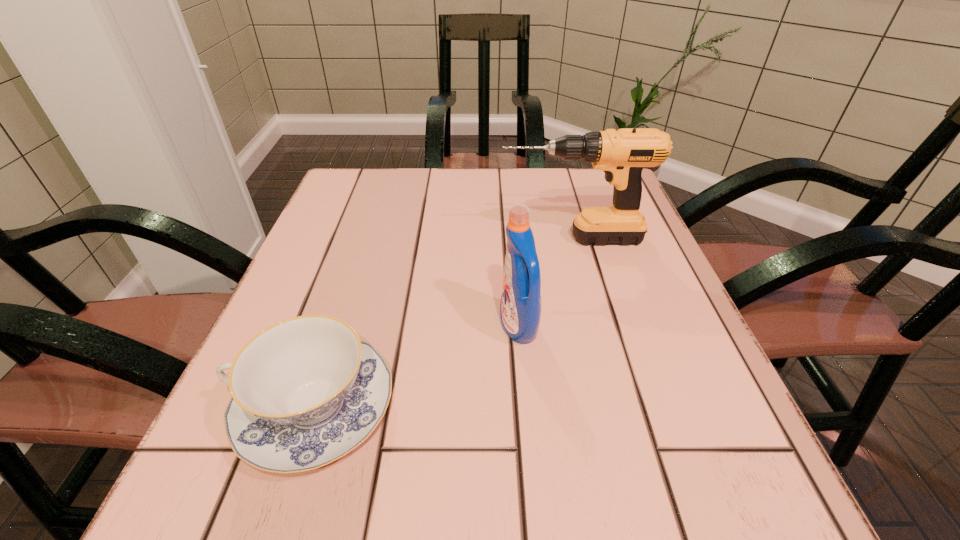
I want to click on empty location between the leftmost object and the farthest object, so click(x=444, y=323).

At what (x,y) coordinates should I click in order to perform the action: click on free spot between the detergent and the leftmost object. Please return your answer as a coordinate pair (x, y). The width and height of the screenshot is (960, 540). Looking at the image, I should click on (417, 367).

Locate an element on the screen. Image resolution: width=960 pixels, height=540 pixels. vacant space that is in between the chinaware and the farthest object is located at coordinates (444, 323).

I want to click on free space between the drill and the detergent, so click(545, 282).

The image size is (960, 540). In order to click on vacant area between the detergent and the chinaware in this screenshot , I will do `click(417, 367)`.

Locate an element on the screen. The image size is (960, 540). free area in between the detergent and the farthest object is located at coordinates (545, 282).

This screenshot has height=540, width=960. Find the location of `free space between the chinaware and the detergent`. free space between the chinaware and the detergent is located at coordinates (417, 367).

At what (x,y) coordinates should I click in order to perform the action: click on empty space between the leftmost object and the detergent. Please return your answer as a coordinate pair (x, y). The image size is (960, 540). Looking at the image, I should click on (417, 367).

Find the location of a particular element. This screenshot has height=540, width=960. free spot between the shortest object and the detergent is located at coordinates (417, 367).

Identify the location of vacant space in between the farthest object and the detergent. This screenshot has height=540, width=960. (545, 282).